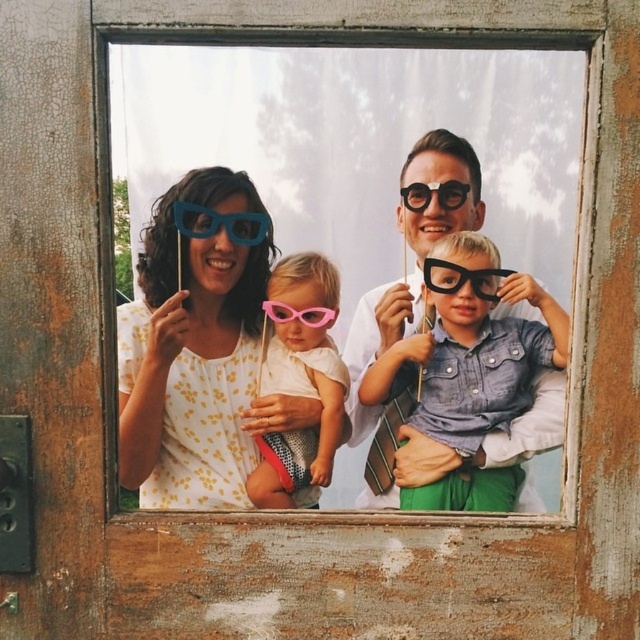
Who is taller, black plastic glasses at center or pink plastic goggles at center?

black plastic glasses at center

Between black plastic glasses at center and pink plastic goggles at center, which one has less height?

pink plastic goggles at center

Between point (484, 298) and point (328, 310), which one is positioned in front?

Point (484, 298)

Where is `black plastic glasses at center`? The height and width of the screenshot is (640, 640). black plastic glasses at center is located at coordinates (461, 278).

Which of these two, blue matte glasses at upper left or matte black glasses at center, stands taller?

blue matte glasses at upper left is taller.

Is point (234, 220) more distant than point (444, 193)?

Yes, it is.

You are a GUI agent. You are given a task and a screenshot of the screen. Output one action in this format:
    pyautogui.click(x=<x>, y=<y>)
    Task: Click on the blue matte glasses at upper left
    Image resolution: width=640 pixels, height=640 pixels.
    Given the screenshot: What is the action you would take?
    pyautogui.click(x=220, y=224)

Which is in front, point (230, 282) or point (408, 204)?

Point (408, 204)

Between matte blue plastic glasses at left and matte black glasses at center, which one is positioned lower?

matte blue plastic glasses at left is lower down.

Where is `matte blue plastic glasses at left`? This screenshot has height=640, width=640. matte blue plastic glasses at left is located at coordinates (198, 348).

At what (x,y) coordinates should I click in order to perform the action: click on matte blue plastic glasses at left. Please return your answer as a coordinate pair (x, y). This screenshot has height=640, width=640. Looking at the image, I should click on [198, 348].